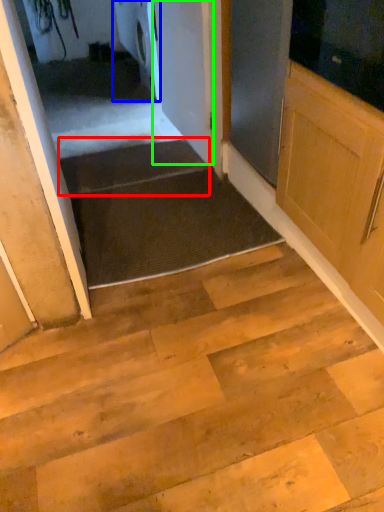
Question: Which is nearer to the stairs (highlighted by a red box)? appliance (highlighted by a blue box) or door (highlighted by a green box).

Choices:
 (A) appliance
 (B) door

Answer: (B)